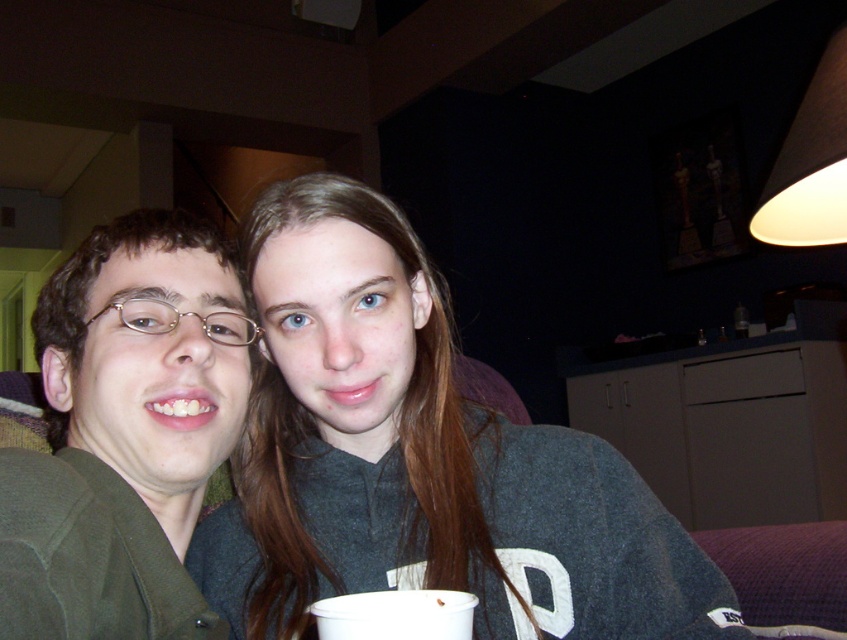
Who is taller, green matte jacket at left or white matte lampshade at upper right?

green matte jacket at left is taller.

How much distance is there between green matte jacket at left and white matte lampshade at upper right?

green matte jacket at left is 95.49 centimeters from white matte lampshade at upper right.

Is point (101, 364) farther from camera compared to point (783, 230)?

No.

Where is `green matte jacket at left`? This screenshot has width=847, height=640. green matte jacket at left is located at coordinates (122, 438).

Which of these two, dark gray sweater at center or green matte jacket at left, stands shorter?

green matte jacket at left

The width and height of the screenshot is (847, 640). Describe the element at coordinates (419, 460) in the screenshot. I see `dark gray sweater at center` at that location.

Identify the location of dark gray sweater at center. This screenshot has height=640, width=847. (419, 460).

How distant is dark gray sweater at center from white matte lampshade at upper right?

31.03 inches

Where is `dark gray sweater at center`? Image resolution: width=847 pixels, height=640 pixels. dark gray sweater at center is located at coordinates (419, 460).